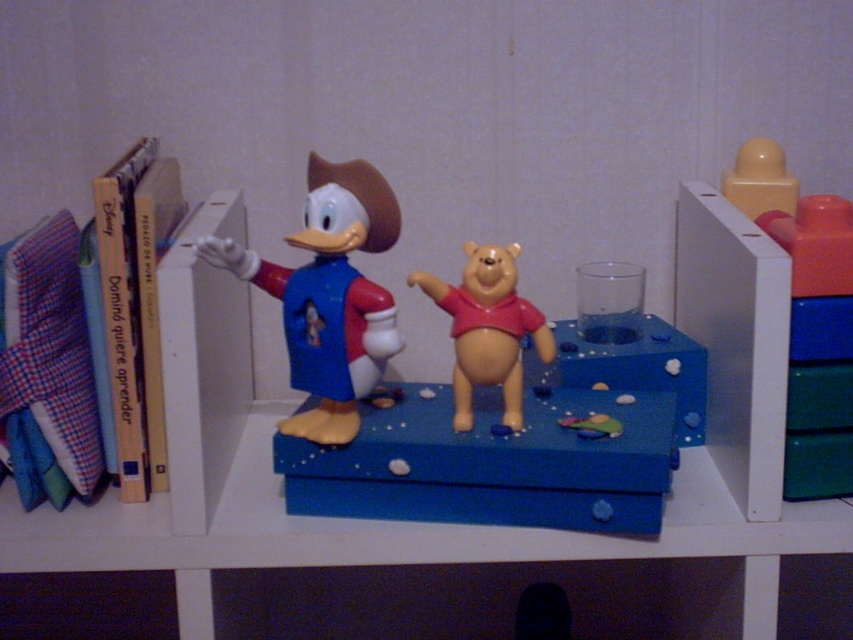
You are organizing a childrens play area and need to place a new toy that is 10 inches long between the smooth yellow bear at center and the yellow matte block at upper right. Can the new toy fit in the space between them?

The distance between the smooth yellow bear at center and the yellow matte block at upper right is 12.35 inches. Since the new toy is 10 inches long, it can fit in the space between them as there is enough room.

You are organizing a childrens bookshelf and need to place a new toy between the smooth yellow bear at center and the yellow matte block at upper right. Based on their current positions, where should you place the new toy to ensure it is between them?

The smooth yellow bear at center is to the left of the yellow matte block at upper right, so you should place the new toy between them to the right of the smooth yellow bear at center and to the left of the yellow matte block at upper right.

You are organizing a childrens play area and need to stack the smooth yellow bear at center and the yellow matte block at upper right. Which one should you place at the bottom to ensure stability?

The smooth yellow bear at center is taller than the yellow matte block at upper right, so placing the taller smooth yellow bear at center at the bottom would provide better stability for the stack.